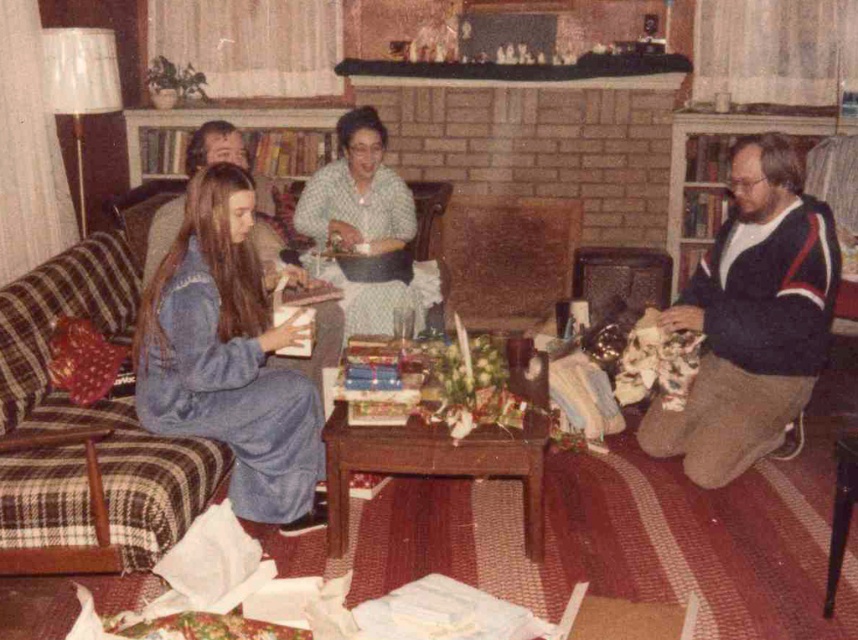
Question: Observing the image, what is the correct spatial positioning of dark blue sweater at right in reference to light green fabric dress at center?

Choices:
 (A) left
 (B) right

Answer: (B)

Question: Which of these objects is positioned closest to the light green fabric dress at center?

Choices:
 (A) plaid fabric couch at left
 (B) dark blue sweater at right
 (C) blue knit sweater at center
 (D) denim tracksuit at left

Answer: (C)

Question: Which point is farther to the camera?

Choices:
 (A) (195, 467)
 (B) (738, 291)
 (C) (360, 253)
 (D) (192, 148)

Answer: (C)

Question: Considering the real-world distances, which object is farthest from the blue knit sweater at center?

Choices:
 (A) denim tracksuit at left
 (B) dark blue sweater at right
 (C) plaid fabric couch at left

Answer: (B)

Question: Does plaid fabric couch at left appear under light green fabric dress at center?

Choices:
 (A) no
 (B) yes

Answer: (B)

Question: Is denim tracksuit at left smaller than blue knit sweater at center?

Choices:
 (A) yes
 (B) no

Answer: (B)